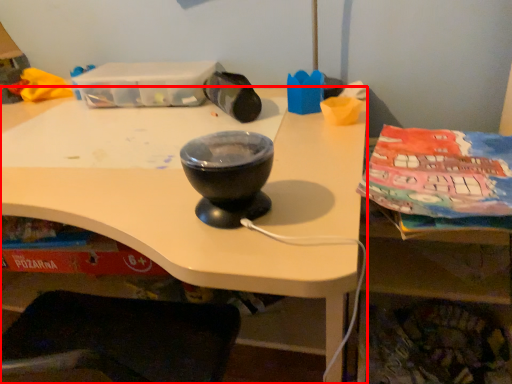
Question: Observing the image, what is the correct spatial positioning of desk (annotated by the red box) in reference to basin?

Choices:
 (A) right
 (B) left

Answer: (B)